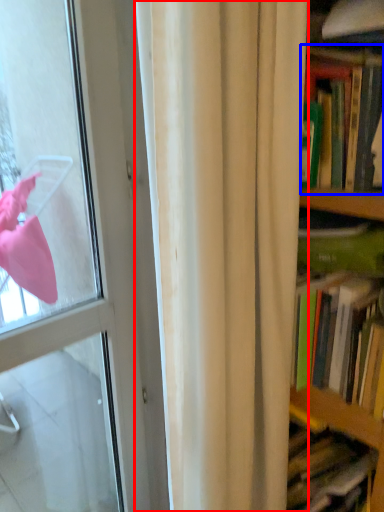
Question: Among these objects, which one is farthest to the camera, curtain (highlighted by a red box) or book (highlighted by a blue box)?

Choices:
 (A) curtain
 (B) book

Answer: (B)